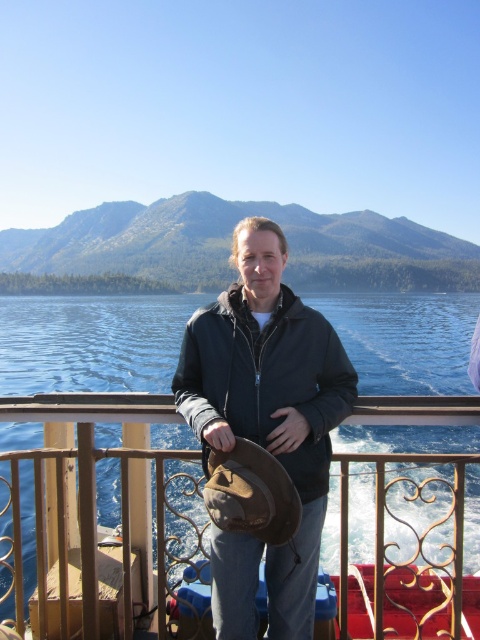
You are a photographer trying to capture the brown leather hat at center in your shot. The camera is positioned at point A, which is at coordinates 0.5, 0.5. Can you determine if the hat is within the camera frame?

The brown leather hat at center is located at point (x=96, y=515), which is to the right and slightly above the camera position at (x=240, y=320). Assuming the camera frame covers a standard field of view, the hat should be within the frame unless the camera is zoomed in tightly. Therefore, the hat is likely visible in the shot.

You are a photographer trying to capture the person on the boat deck. Since you want to emphasize the height difference between the brown leather hat at center and the matte black jacket at center, which object should you focus on to highlight the taller one?

The brown leather hat at center is much taller than the matte black jacket at center, so focusing on the brown leather hat at center would effectively highlight the taller object.